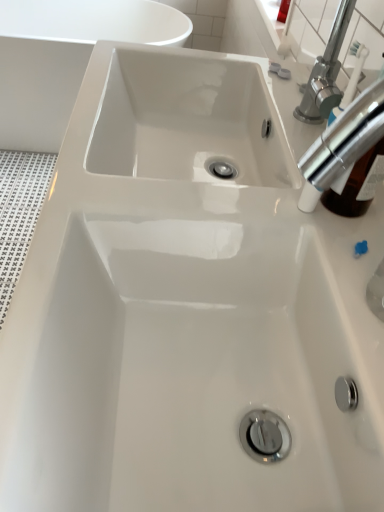
Question: Is white glossy bathtub at upper left taller than chrome metallic tap at upper right?

Choices:
 (A) yes
 (B) no

Answer: (A)

Question: Does white glossy bathtub at upper left have a lesser height compared to chrome metallic tap at upper right?

Choices:
 (A) no
 (B) yes

Answer: (A)

Question: Is white glossy bathtub at upper left touching chrome metallic tap at upper right?

Choices:
 (A) no
 (B) yes

Answer: (A)

Question: Considering the relative sizes of white glossy bathtub at upper left and chrome metallic tap at upper right in the image provided, is white glossy bathtub at upper left bigger than chrome metallic tap at upper right?

Choices:
 (A) no
 (B) yes

Answer: (B)

Question: Can you confirm if white glossy bathtub at upper left is smaller than chrome metallic tap at upper right?

Choices:
 (A) yes
 (B) no

Answer: (B)

Question: Can you confirm if white glossy bathtub at upper left is wider than chrome metallic tap at upper right?

Choices:
 (A) yes
 (B) no

Answer: (A)

Question: From the image's perspective, is chrome metallic tap at upper right on top of white glossy bathtub at upper left?

Choices:
 (A) no
 (B) yes

Answer: (A)

Question: From a real-world perspective, is chrome metallic tap at upper right over white glossy bathtub at upper left?

Choices:
 (A) no
 (B) yes

Answer: (B)

Question: From a real-world perspective, is chrome metallic tap at upper right located beneath white glossy bathtub at upper left?

Choices:
 (A) no
 (B) yes

Answer: (A)

Question: Does chrome metallic tap at upper right appear on the right side of white glossy bathtub at upper left?

Choices:
 (A) no
 (B) yes

Answer: (B)

Question: Does chrome metallic tap at upper right contain white glossy bathtub at upper left?

Choices:
 (A) yes
 (B) no

Answer: (B)

Question: Is chrome metallic tap at upper right closer to camera compared to white glossy bathtub at upper left?

Choices:
 (A) no
 (B) yes

Answer: (B)

Question: Considering the positions of white glossy bathtub at upper left and chrome metallic tap at upper right in the image, is white glossy bathtub at upper left wider or thinner than chrome metallic tap at upper right?

Choices:
 (A) wide
 (B) thin

Answer: (A)